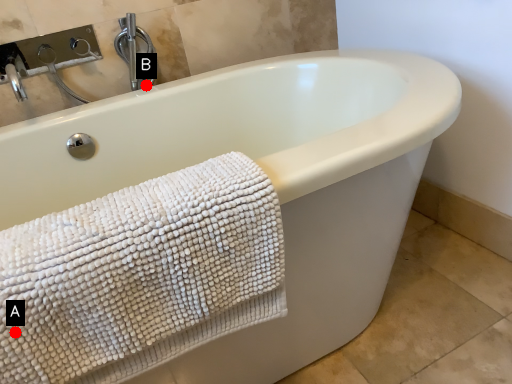
Question: Two points are circled on the image, labeled by A and B beside each circle. Among these points, which one is nearest to the camera?

Choices:
 (A) A is closer
 (B) B is closer

Answer: (A)